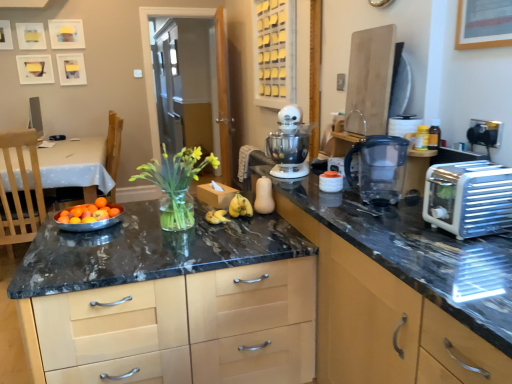
Where is `vacant space to the left of white plastic toaster at right`? Image resolution: width=512 pixels, height=384 pixels. vacant space to the left of white plastic toaster at right is located at coordinates (398, 233).